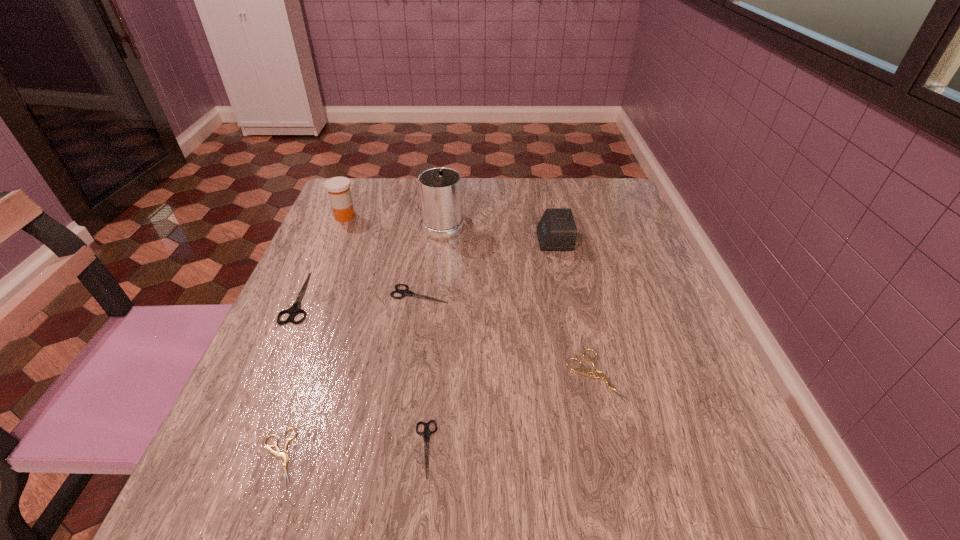
The width and height of the screenshot is (960, 540). In order to click on the third nearest shears in this screenshot , I will do `click(589, 373)`.

Where is `the sixth farthest object`? The image size is (960, 540). the sixth farthest object is located at coordinates (589, 373).

Locate an element on the screen. The width and height of the screenshot is (960, 540). the nearest black shears is located at coordinates (426, 433).

Find the location of a particular element. The height and width of the screenshot is (540, 960). the left beige shears is located at coordinates (285, 456).

Identify the location of the shortest shears. The image size is (960, 540). (285, 456).

You are a GUI agent. You are given a task and a screenshot of the screen. Output one action in this format:
    pyautogui.click(x=<x>, y=<y>)
    Task: Click on the free point located 0.150m on the side of the gray mug with the handle
    
    Given the screenshot: What is the action you would take?
    pyautogui.click(x=448, y=180)

In order to click on free space located on the label of the medicine in this screenshot , I will do `click(482, 217)`.

Where is `blank area located on the front-facing side of the alarm clock`? blank area located on the front-facing side of the alarm clock is located at coordinates tap(417, 240).

Where is `vacant area located on the front-facing side of the alarm clock`? vacant area located on the front-facing side of the alarm clock is located at coordinates (404, 240).

Identify the location of vacant area situated on the front-facing side of the alarm clock. (509, 240).